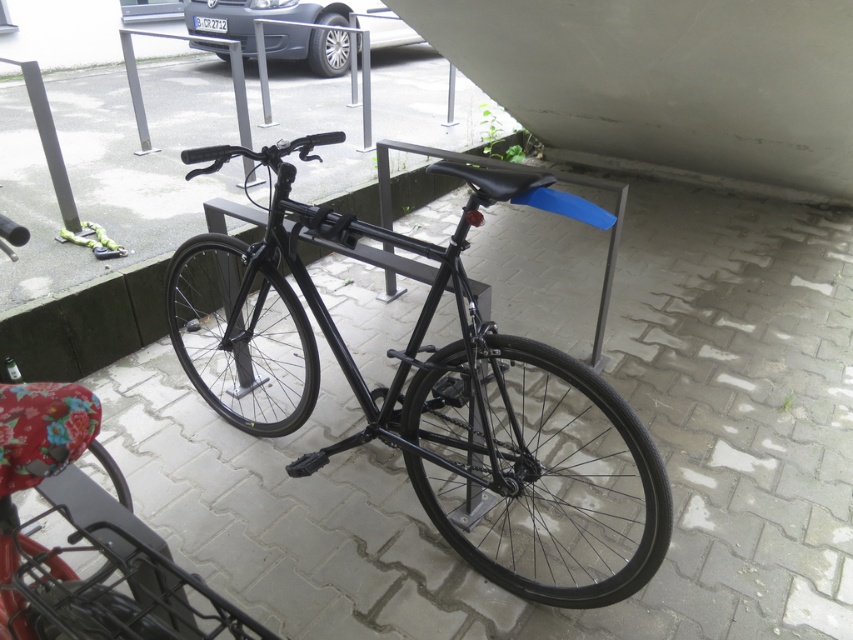
Question: Considering the relative positions of black matte bicycle at center and silver metallic car at upper center in the image provided, where is black matte bicycle at center located with respect to silver metallic car at upper center?

Choices:
 (A) above
 (B) below

Answer: (B)

Question: Which of the following is the closest to the observer?

Choices:
 (A) (242, 44)
 (B) (492, 378)

Answer: (B)

Question: Which point is closer to the camera?

Choices:
 (A) black matte bicycle at center
 (B) silver metallic car at upper center

Answer: (A)

Question: Does black matte bicycle at center appear over silver metallic car at upper center?

Choices:
 (A) no
 (B) yes

Answer: (A)

Question: Is black matte bicycle at center thinner than silver metallic car at upper center?

Choices:
 (A) no
 (B) yes

Answer: (B)